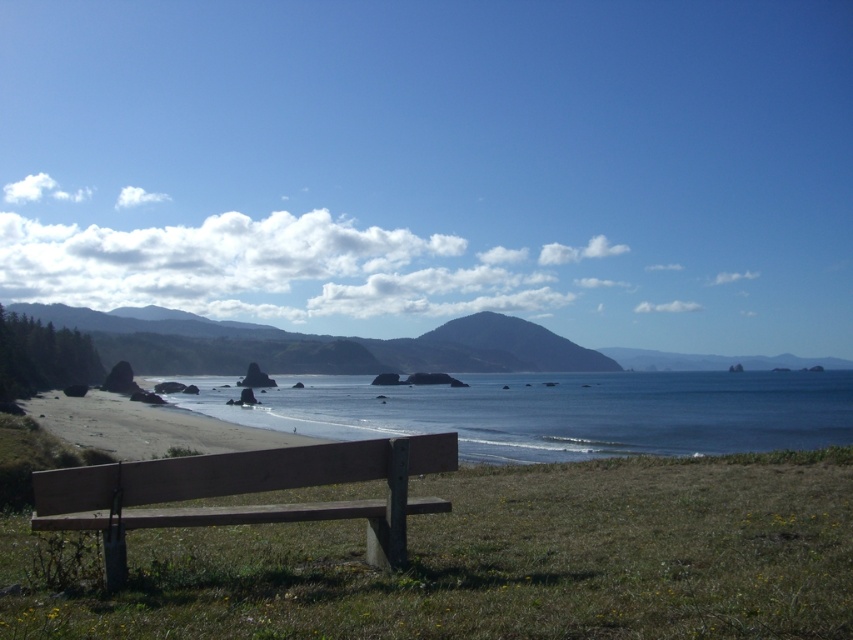
Question: Does green grass at lower center appear under blue water at center?

Choices:
 (A) yes
 (B) no

Answer: (B)

Question: Which of the following is the farthest from the observer?

Choices:
 (A) blue water at center
 (B) green grass at lower center

Answer: (A)

Question: Which point appears farthest from the camera in this image?

Choices:
 (A) (207, 602)
 (B) (404, 557)
 (C) (605, 444)

Answer: (C)

Question: Which of the following is the closest to the observer?

Choices:
 (A) green grass at lower center
 (B) wooden bench at lower left

Answer: (A)

Question: Does green grass at lower center lie behind blue water at center?

Choices:
 (A) no
 (B) yes

Answer: (A)

Question: Does blue water at center appear on the right side of wooden bench at lower left?

Choices:
 (A) no
 (B) yes

Answer: (B)